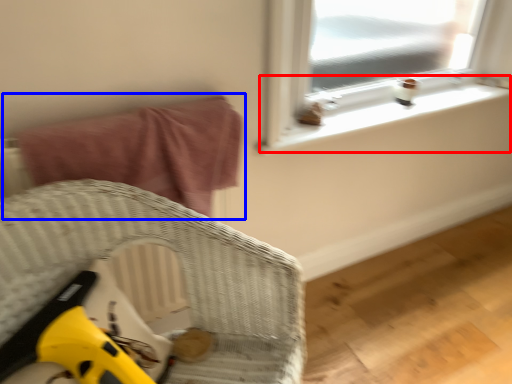
Question: Which object appears closest to the camera in this image, window sill (highlighted by a red box) or bed (highlighted by a blue box)?

Choices:
 (A) window sill
 (B) bed

Answer: (B)